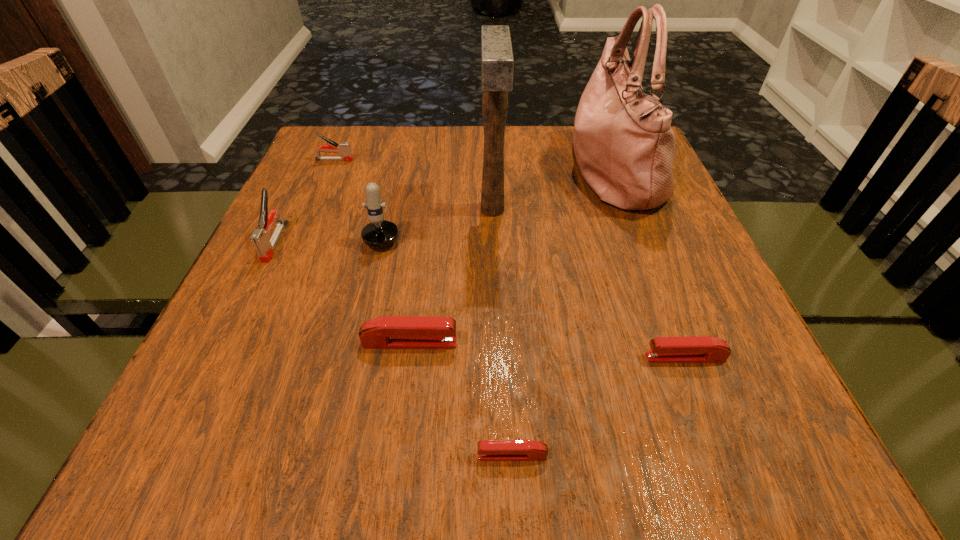
Locate an element on the screen. vacant region between the fourth tallest object and the handbag is located at coordinates (444, 206).

Find the location of a particular element. This screenshot has width=960, height=540. vacant point located between the farther gray stapler and the third shortest stapler is located at coordinates (372, 251).

Where is `free space between the mallet and the second smallest red stapler`? The image size is (960, 540). free space between the mallet and the second smallest red stapler is located at coordinates (588, 284).

In order to click on empty location between the nearest red stapler and the handbag in this screenshot , I will do `click(563, 313)`.

Locate an element on the screen. Image resolution: width=960 pixels, height=540 pixels. free point between the seventh farthest object and the farthest red stapler is located at coordinates (547, 350).

Image resolution: width=960 pixels, height=540 pixels. I want to click on empty location between the third stapler from right to left and the tallest stapler, so click(343, 292).

Where is `free space between the second shortest stapler and the microphone`? free space between the second shortest stapler and the microphone is located at coordinates (536, 292).

Find the location of `vacant space that's between the mallet and the sixth farthest object`. vacant space that's between the mallet and the sixth farthest object is located at coordinates (451, 276).

Image resolution: width=960 pixels, height=540 pixels. Find the location of `unoccupied area between the white microphone and the second nearest stapler`. unoccupied area between the white microphone and the second nearest stapler is located at coordinates (536, 292).

Select which object appears as the sixth closest to the second red stapler from right to left. Please provide its 2D coordinates. Your answer should be formatted as a tuple, i.e. [(x, y)], where the tuple contains the x and y coordinates of a point satisfying the conditions above.

[(260, 237)]